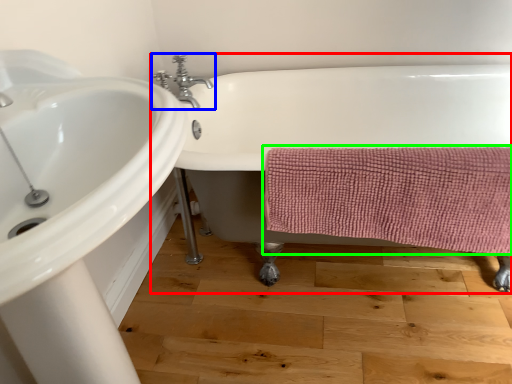
Question: Considering the real-world distances, which object is closest to bathtub (highlighted by a red box)? tap (highlighted by a blue box) or bath towel (highlighted by a green box).

Choices:
 (A) tap
 (B) bath towel

Answer: (B)